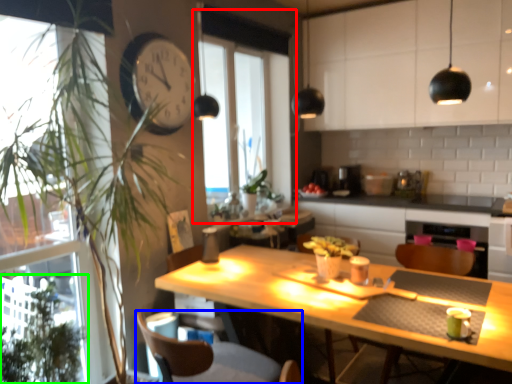
Question: Estimate the real-world distances between objects in this image. Which object is closer to window (highlighted by a red box), swivel chair (highlighted by a blue box) or plant (highlighted by a green box)?

Choices:
 (A) swivel chair
 (B) plant

Answer: (A)